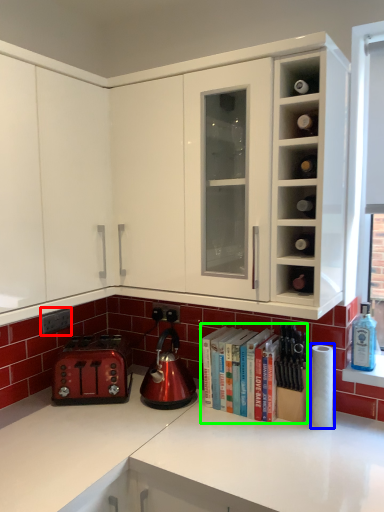
Question: Which object is the closest to the electric outlet (highlighted by a red box)? Choose among these: paper towel (highlighted by a blue box) or book (highlighted by a green box).

Choices:
 (A) paper towel
 (B) book

Answer: (B)